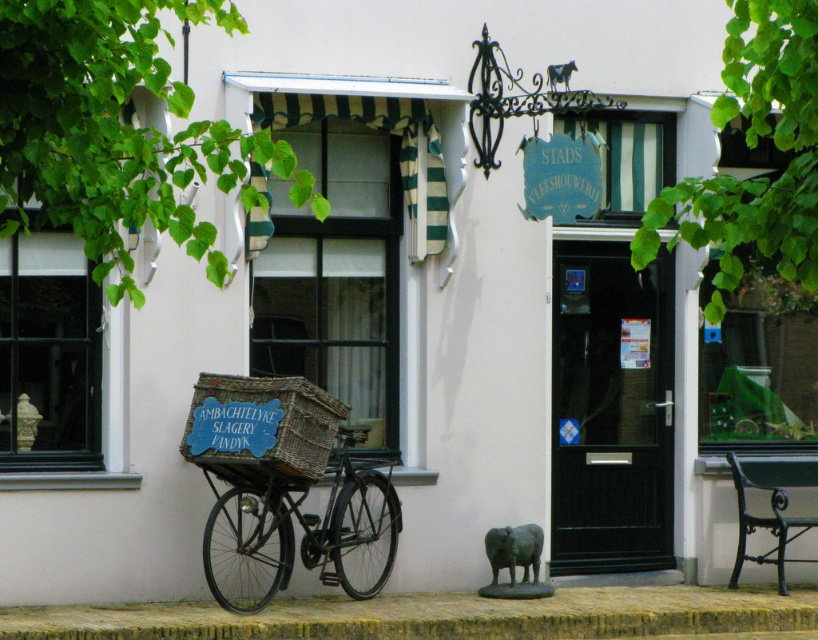
Can you confirm if brick at lower center is bigger than woven brown crate at center?

Indeed, brick at lower center has a larger size compared to woven brown crate at center.

Is brick at lower center wider than woven brown crate at center?

Correct, the width of brick at lower center exceeds that of woven brown crate at center.

Does point (533, 618) come in front of point (258, 432)?

No, (533, 618) is further to viewer.

Identify the location of brick at lower center. (437, 616).

Does brick at lower center appear under black matte bicycle at center?

Yes.

Is brick at lower center taller than black matte bicycle at center?

In fact, brick at lower center may be shorter than black matte bicycle at center.

Does point (131, 611) come behind point (372, 484)?

No, it is in front of (372, 484).

I want to click on brick at lower center, so click(x=437, y=616).

From the picture: Can you confirm if black matte bicycle at center is positioned above woven brown crate at center?

Incorrect, black matte bicycle at center is not positioned above woven brown crate at center.

How distant is black matte bicycle at center from woven brown crate at center?

15.74 inches

Does point (237, 596) come behind point (330, 426)?

Yes, it is behind point (330, 426).

The width and height of the screenshot is (818, 640). I want to click on black matte bicycle at center, so click(300, 528).